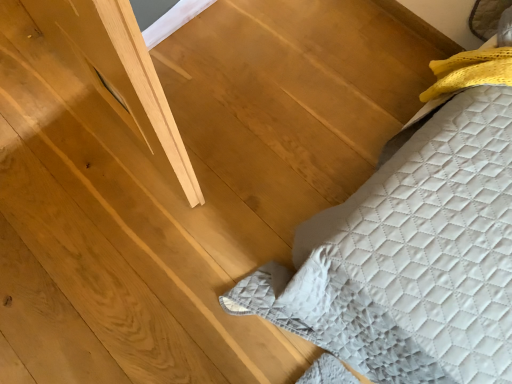
Question: From the image's perspective, is quilted fabric bed at lower right located above or below matte gray window at upper left?

Choices:
 (A) below
 (B) above

Answer: (A)

Question: Choose the correct answer: Is quilted fabric bed at lower right inside matte gray window at upper left or outside it?

Choices:
 (A) outside
 (B) inside

Answer: (A)

Question: Is quilted fabric bed at lower right taller or shorter than matte gray window at upper left?

Choices:
 (A) short
 (B) tall

Answer: (A)

Question: In the image, is matte gray window at upper left positioned in front of or behind quilted fabric bed at lower right?

Choices:
 (A) front
 (B) behind

Answer: (B)

Question: Based on their positions, is matte gray window at upper left located to the left or right of quilted fabric bed at lower right?

Choices:
 (A) left
 (B) right

Answer: (A)

Question: Is matte gray window at upper left bigger or smaller than quilted fabric bed at lower right?

Choices:
 (A) small
 (B) big

Answer: (A)

Question: Considering the positions of matte gray window at upper left and quilted fabric bed at lower right in the image, is matte gray window at upper left wider or thinner than quilted fabric bed at lower right?

Choices:
 (A) wide
 (B) thin

Answer: (B)